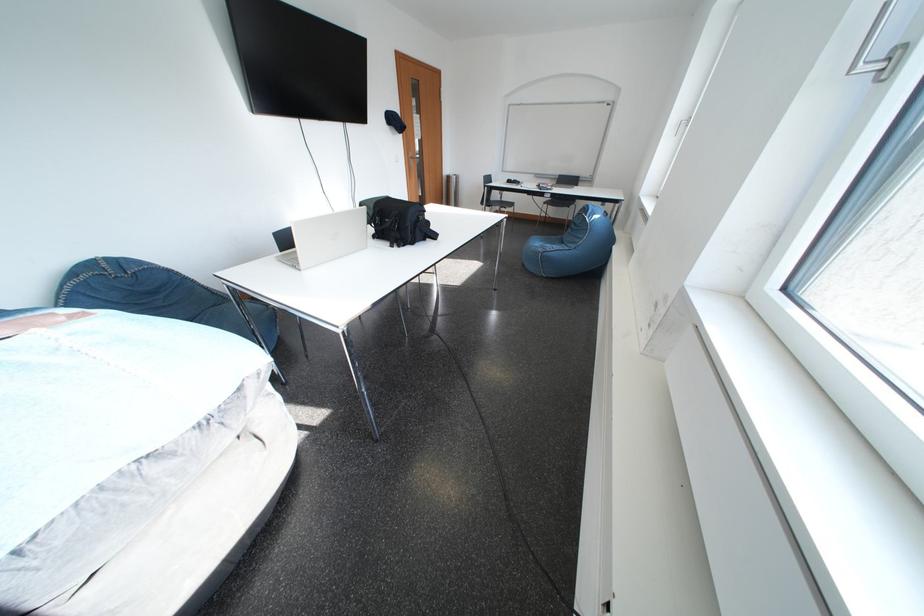
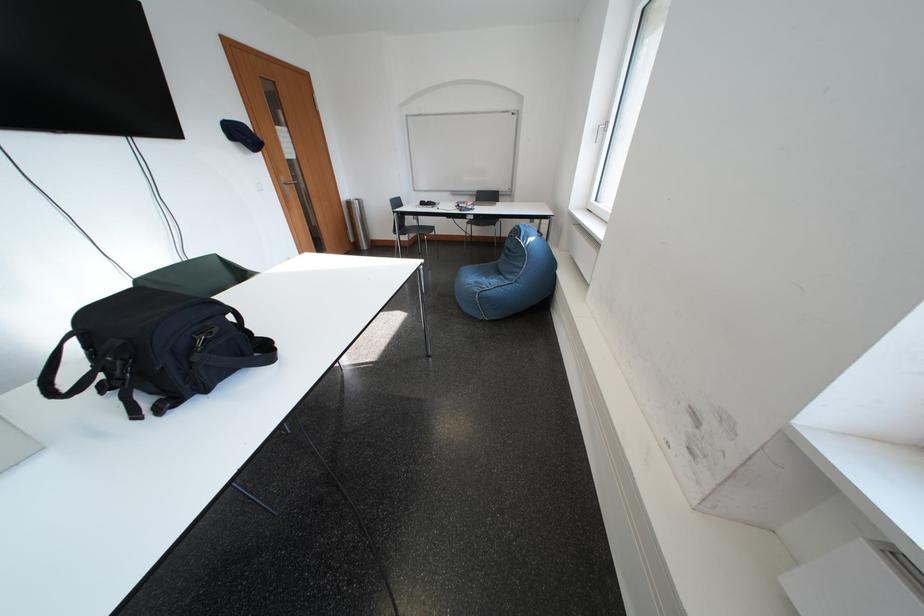
Locate, in the second image, the point that corresponds to point (505, 199) in the first image.

(420, 225)